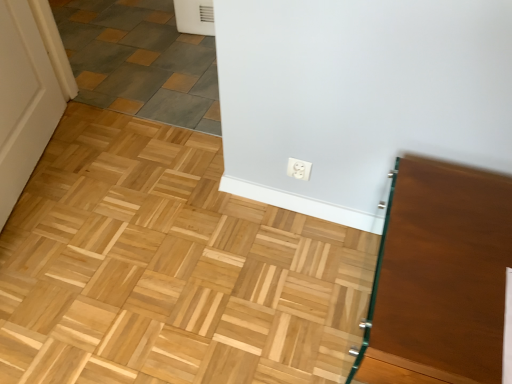
Where is `gray slate tile at upper left`? This screenshot has width=512, height=384. gray slate tile at upper left is located at coordinates (140, 61).

Find the location of a particular element. The width and height of the screenshot is (512, 384). brown glossy vanity at right is located at coordinates (439, 277).

Can you tell me how much brown glossy vanity at right and gray slate tile at upper left differ in facing direction?

The angular difference between brown glossy vanity at right and gray slate tile at upper left is 0.731 degrees.

From the picture: Looking at their sizes, would you say brown glossy vanity at right is wider or thinner than gray slate tile at upper left?

Considering their sizes, brown glossy vanity at right looks slimmer than gray slate tile at upper left.

This screenshot has height=384, width=512. In order to click on tile that is above the brown glossy vanity at right (from the image's perspective) in this screenshot , I will do 140,61.

From the picture: Is brown glossy vanity at right facing away from gray slate tile at upper left?

That's not correct — brown glossy vanity at right is not looking away from gray slate tile at upper left.

Which object is more forward, gray slate tile at upper left or brown glossy vanity at right?

brown glossy vanity at right.

Is point (115, 31) farther from viewer compared to point (481, 250)?

That is True.

Is brown glossy vanity at right a part of gray slate tile at upper left?

Actually, brown glossy vanity at right is outside gray slate tile at upper left.

Locate an element on the screen. This screenshot has height=384, width=512. vanity in front of the white plastic outlet at center is located at coordinates (439, 277).

Which of these two, brown glossy vanity at right or white plastic outlet at center, stands shorter?

white plastic outlet at center.

Does brown glossy vanity at right have a smaller size compared to white plastic outlet at center?

No.

From the image's perspective, does brown glossy vanity at right appear lower than white plastic outlet at center?

Yes, from the image's perspective, brown glossy vanity at right is below white plastic outlet at center.

From the image's perspective, which is below, white plastic outlet at center or gray slate tile at upper left?

white plastic outlet at center, from the image's perspective.

From a real-world perspective, which is physically below, white plastic outlet at center or gray slate tile at upper left?

From a 3D spatial view, gray slate tile at upper left is below.

Between point (306, 169) and point (109, 8), which one is positioned behind?

Point (109, 8)

From the image's perspective, is gray slate tile at upper left over white plastic outlet at center?

Yes, from the image's perspective, gray slate tile at upper left is over white plastic outlet at center.

Does point (218, 109) come farther from viewer compared to point (304, 170)?

Yes, point (218, 109) is farther from viewer.

Is gray slate tile at upper left wider than white plastic outlet at center?

Correct, the width of gray slate tile at upper left exceeds that of white plastic outlet at center.

Can you tell me how much gray slate tile at upper left and white plastic outlet at center differ in facing direction?

The angular difference between gray slate tile at upper left and white plastic outlet at center is 0.359 degrees.

In the image, is white plastic outlet at center positioned in front of or behind brown glossy vanity at right?

Visually, white plastic outlet at center is located behind brown glossy vanity at right.

Considering the positions of point (302, 176) and point (384, 281), is point (302, 176) closer or farther from the camera than point (384, 281)?

Point (302, 176) appears to be farther away from the viewer than point (384, 281).

Is white plastic outlet at center facing away from brown glossy vanity at right?

No, white plastic outlet at center is not facing the opposite direction of brown glossy vanity at right.

Is white plastic outlet at center next to brown glossy vanity at right?

No, white plastic outlet at center is not beside brown glossy vanity at right.

This screenshot has width=512, height=384. I want to click on vanity below the gray slate tile at upper left (from the image's perspective), so click(x=439, y=277).

Identify the location of vanity that appears above the gray slate tile at upper left (from a real-world perspective). (439, 277).

When comparing their distances from brown glossy vanity at right, does white plastic outlet at center or gray slate tile at upper left seem further?

Based on the image, gray slate tile at upper left appears to be further to brown glossy vanity at right.

From the image, which object appears to be nearer to white plastic outlet at center, gray slate tile at upper left or brown glossy vanity at right?

Among the two, brown glossy vanity at right is located nearer to white plastic outlet at center.

Based on their spatial positions, is brown glossy vanity at right or white plastic outlet at center further from gray slate tile at upper left?

The object further to gray slate tile at upper left is brown glossy vanity at right.

Looking at the image, which one is located further to white plastic outlet at center, brown glossy vanity at right or gray slate tile at upper left?

gray slate tile at upper left.

Considering their positions, is gray slate tile at upper left positioned closer to brown glossy vanity at right than white plastic outlet at center?

Among the two, white plastic outlet at center is located nearer to brown glossy vanity at right.

Which object lies further to the anchor point gray slate tile at upper left, white plastic outlet at center or brown glossy vanity at right?

Based on the image, brown glossy vanity at right appears to be further to gray slate tile at upper left.

The height and width of the screenshot is (384, 512). I want to click on electric outlet situated between gray slate tile at upper left and brown glossy vanity at right from left to right, so click(298, 169).